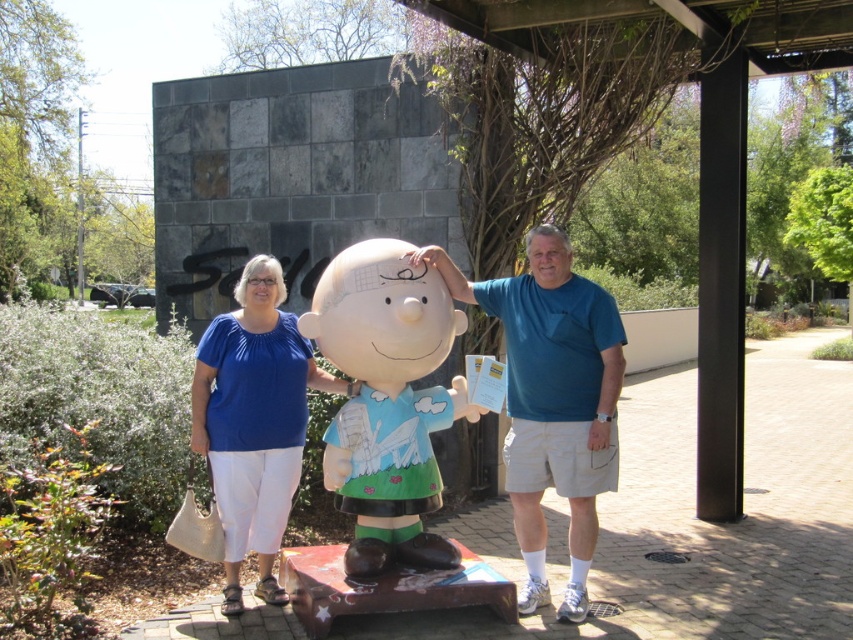
You are a photographer trying to capture a group photo of the matte blue shirt at center and the blue cotton shirt at center. Which one should you focus on first if you want to start from the left side?

The matte blue shirt at center is positioned on the left side of blue cotton shirt at center, so you should focus on the matte blue shirt at center first.

You are an artist trying to paint this scene. You need to decide which object to paint first based on their widths. Since you want to paint the wider object first, which one should you choose between the matte blue shirt at center and the matte blue blouse at center?

The matte blue shirt at center is wider than the matte blue blouse at center, so you should paint the matte blue shirt at center first.

You are standing at the point labeled as point (418, 300) in the image. The statue of Charlie Brown is 12.71 feet away from you. If you want to take a photo of the statue with both people in the background, will you be able to include them in the frame?

The distance of point (418, 300) from viewer is 12.71 feet. Since the statue is at that distance, the two people posing with the statue would be in the same plane as the statue, so they should be included in the frame when taking a photo of the statue from that point.